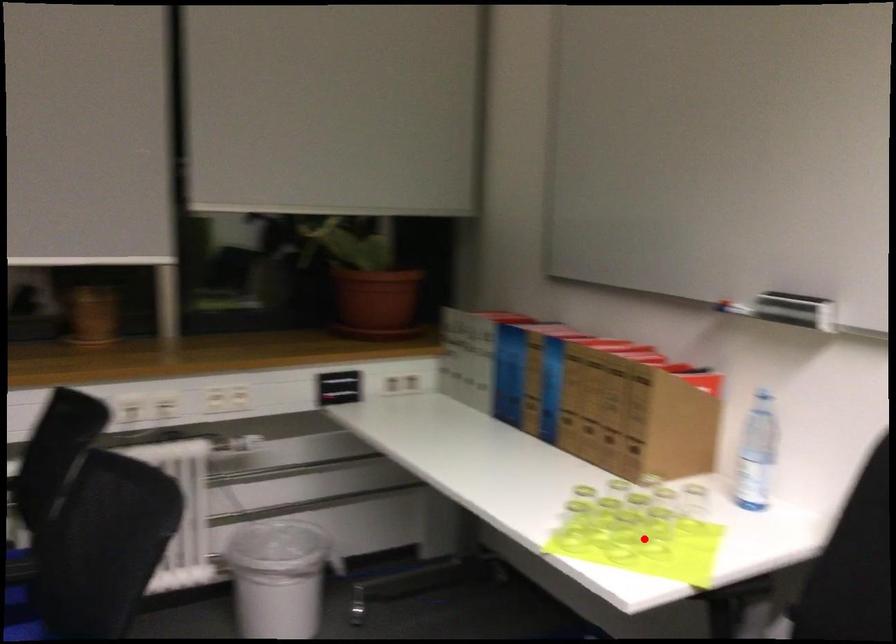
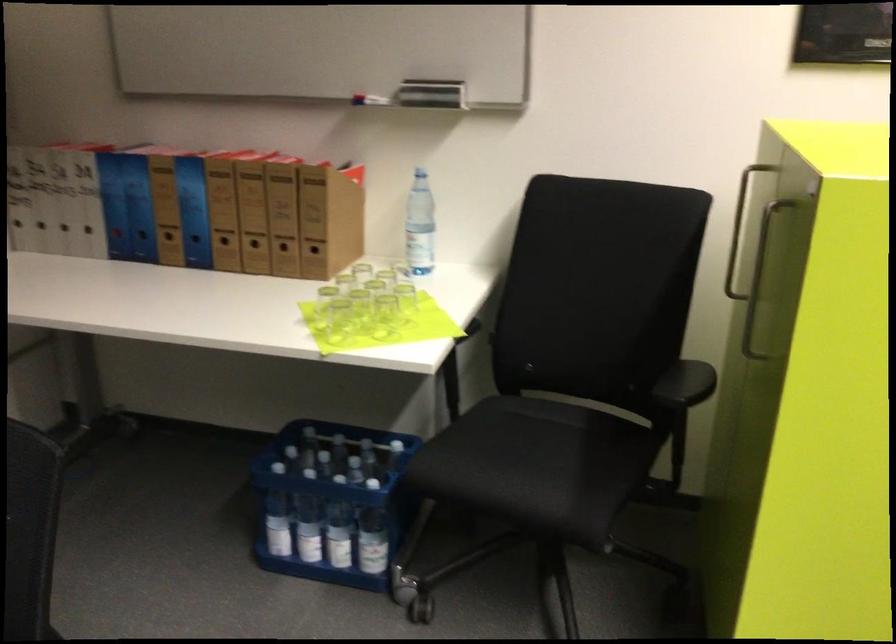
In the second image, find the point that corresponds to the highlighted location in the first image.

(383, 316)